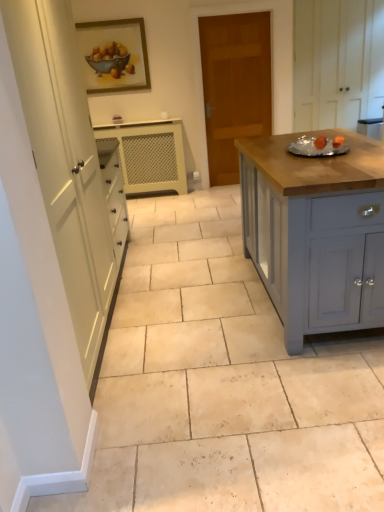
The image size is (384, 512). I want to click on free spot above white tile floor at center (from a real-world perspective), so click(167, 269).